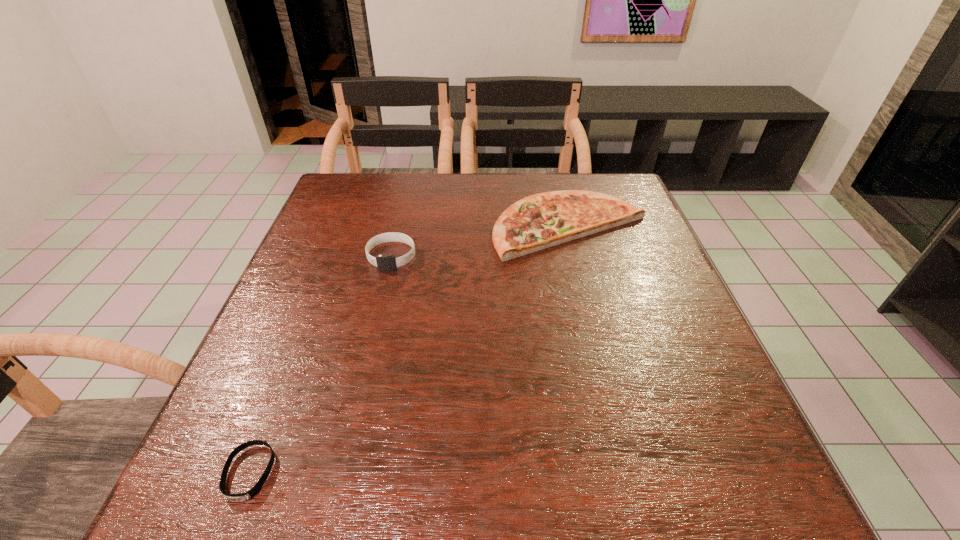
Image resolution: width=960 pixels, height=540 pixels. What are the coordinates of `the rightmost object` in the screenshot? It's located at (543, 220).

This screenshot has height=540, width=960. In order to click on the right wristband in this screenshot , I will do `click(384, 262)`.

Identify the location of the farther wristband. The image size is (960, 540). (384, 262).

At what (x,y) coordinates should I click in order to perform the action: click on the shorter wristband. Please return your answer as a coordinate pair (x, y). This screenshot has width=960, height=540. Looking at the image, I should click on (x=254, y=491).

Image resolution: width=960 pixels, height=540 pixels. What are the coordinates of `the shortest object` in the screenshot? It's located at (x=254, y=491).

Identify the location of vacant region located 0.150m on the left of the pizza. (436, 226).

At what (x,y) coordinates should I click in order to perform the action: click on vacant area situated on the outer surface of the second object from left to right. Please return your answer as a coordinate pair (x, y). Looking at the image, I should click on (361, 386).

What are the coordinates of `object positioned at the far edge` in the screenshot? It's located at (543, 220).

Identify the location of object located at the near edge. (254, 491).

The height and width of the screenshot is (540, 960). What are the coordinates of `object present at the left edge` in the screenshot? It's located at (254, 491).